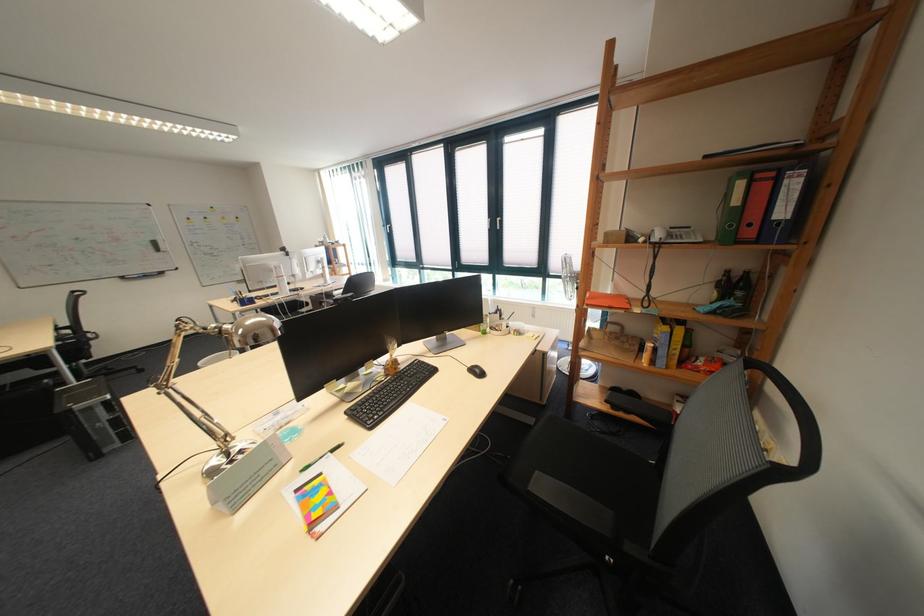
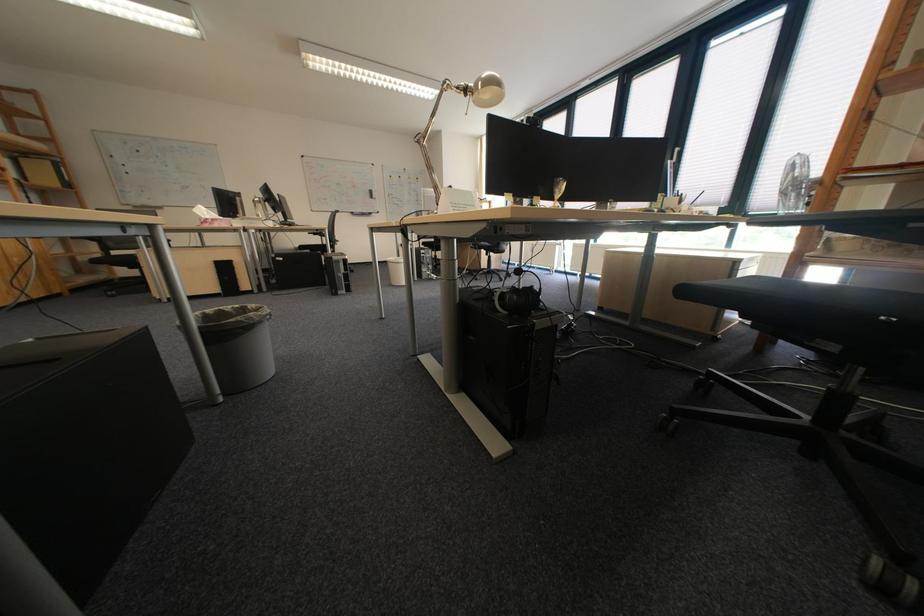
Question: Based on the continuous images, in which direction is the camera rotating? Reply with the corresponding letter.

Choices:
 (A) Left
 (B) Right
 (C) Up
 (D) Down

Answer: (A)